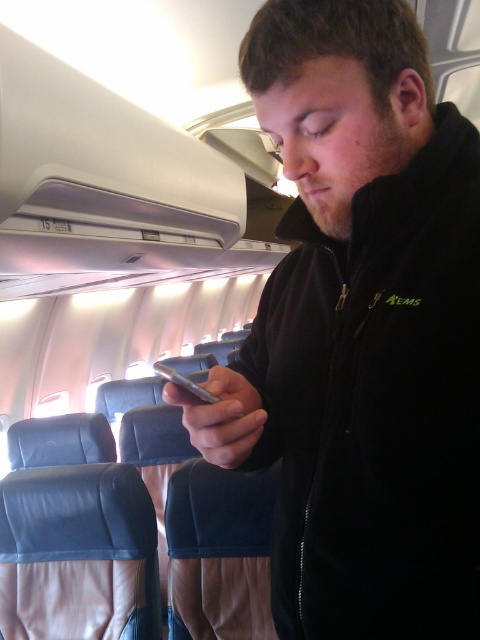
Does black fleece jacket at center appear over green fabric aems at center?

No.

Between black fleece jacket at center and green fabric aems at center, which one has less height?

With less height is green fabric aems at center.

Between point (408, 237) and point (385, 301), which one is positioned in front?

Positioned in front is point (385, 301).

Where is `black fleece jacket at center`? black fleece jacket at center is located at coordinates (360, 332).

Does black fleece jacket at center appear over silver metallic smartphone at center?

Indeed, black fleece jacket at center is positioned over silver metallic smartphone at center.

Who is positioned more to the right, black fleece jacket at center or silver metallic smartphone at center?

black fleece jacket at center is more to the right.

Identify the location of black fleece jacket at center. This screenshot has width=480, height=640. (360, 332).

Find the location of a particular element. black fleece jacket at center is located at coordinates (360, 332).

Is point (204, 394) behind point (396, 292)?

No, it is in front of (396, 292).

The image size is (480, 640). I want to click on silver metallic smartphone at center, so click(x=183, y=381).